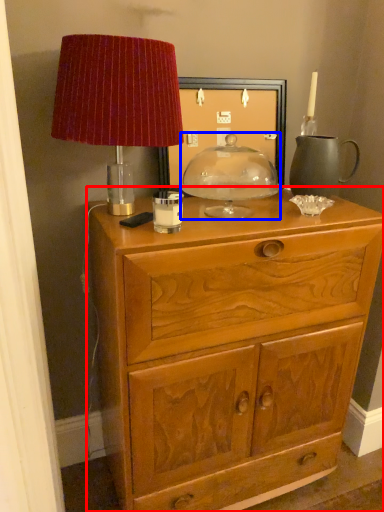
Question: Among these objects, which one is nearest to the camera, chest of drawers (highlighted by a red box) or candle holder (highlighted by a blue box)?

Choices:
 (A) chest of drawers
 (B) candle holder

Answer: (A)